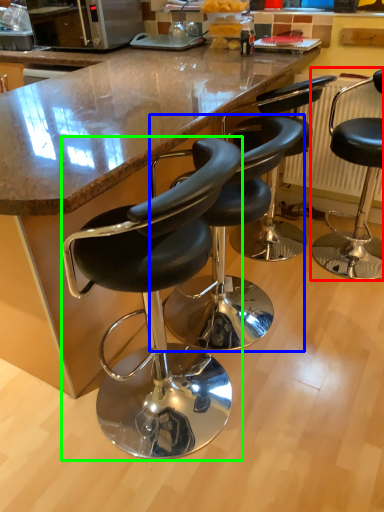
Question: Estimate the real-world distances between objects in this image. Which object is farther from chair (highlighted by a red box), chair (highlighted by a blue box) or chair (highlighted by a green box)?

Choices:
 (A) chair
 (B) chair

Answer: (B)